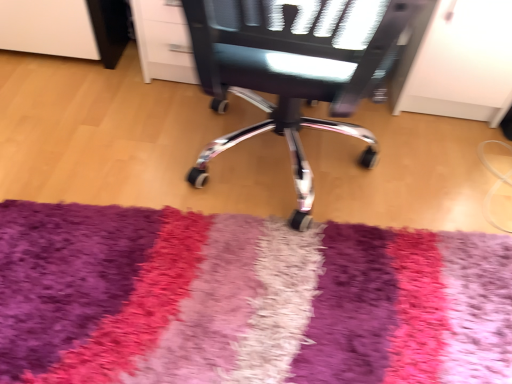
Question: Is point (199, 266) positioned closer to the camera than point (304, 173)?

Choices:
 (A) closer
 (B) farther

Answer: (A)

Question: Is shaggy multicolor rug at center to the left or to the right of metallic mesh chair at center in the image?

Choices:
 (A) left
 (B) right

Answer: (A)

Question: Is shaggy multicolor rug at center wider or thinner than metallic mesh chair at center?

Choices:
 (A) wide
 (B) thin

Answer: (B)

Question: From the image's perspective, relative to shaggy multicolor rug at center, is metallic mesh chair at center above or below?

Choices:
 (A) above
 (B) below

Answer: (A)

Question: Would you say metallic mesh chair at center is to the left or to the right of shaggy multicolor rug at center in the picture?

Choices:
 (A) left
 (B) right

Answer: (B)

Question: From a real-world perspective, is metallic mesh chair at center positioned above or below shaggy multicolor rug at center?

Choices:
 (A) above
 (B) below

Answer: (A)

Question: Do you think metallic mesh chair at center is within shaggy multicolor rug at center, or outside of it?

Choices:
 (A) outside
 (B) inside

Answer: (A)